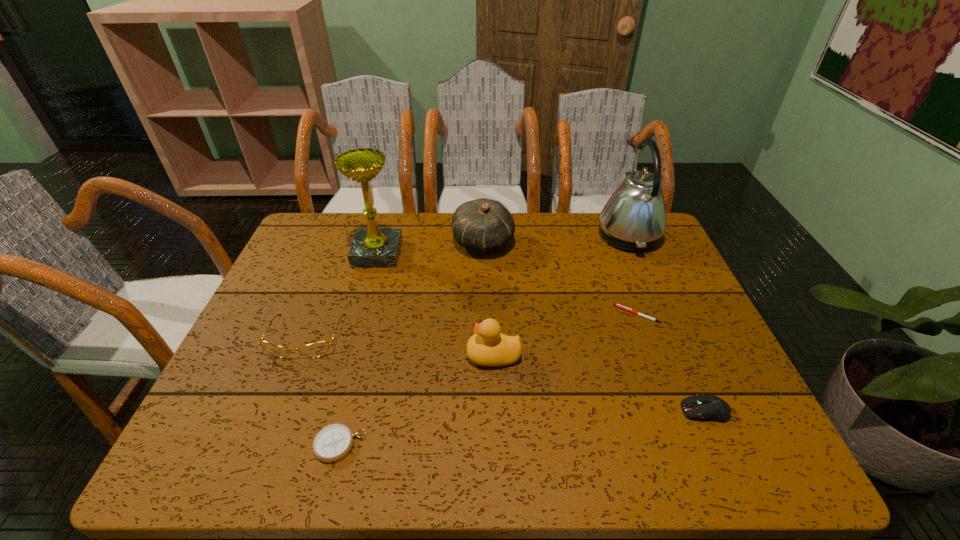
Find the location of `object situated at the left edge`. object situated at the left edge is located at coordinates (317, 349).

Find the location of a particular element. The image size is (960, 540). kettle present at the right edge is located at coordinates (634, 218).

Find the location of a particular element. The width and height of the screenshot is (960, 540). computer equipment present at the right edge is located at coordinates (706, 407).

I want to click on pen located in the right edge section of the desktop, so click(x=616, y=305).

Where is `object located at the far right corner`? This screenshot has height=540, width=960. object located at the far right corner is located at coordinates (634, 218).

Where is `free space at the far edge of the desktop`? The image size is (960, 540). free space at the far edge of the desktop is located at coordinates (440, 236).

In the image, there is a desktop. Identify the location of free space at the near edge. (274, 464).

At what (x,y) coordinates should I click in order to perform the action: click on vacant space at the left edge. Please return your answer as a coordinate pair (x, y). Looking at the image, I should click on (249, 372).

The image size is (960, 540). I want to click on vacant area at the near right corner, so click(726, 443).

Where is `empty space between the fifth shortest object and the shortest object`? Image resolution: width=960 pixels, height=540 pixels. empty space between the fifth shortest object and the shortest object is located at coordinates (565, 335).